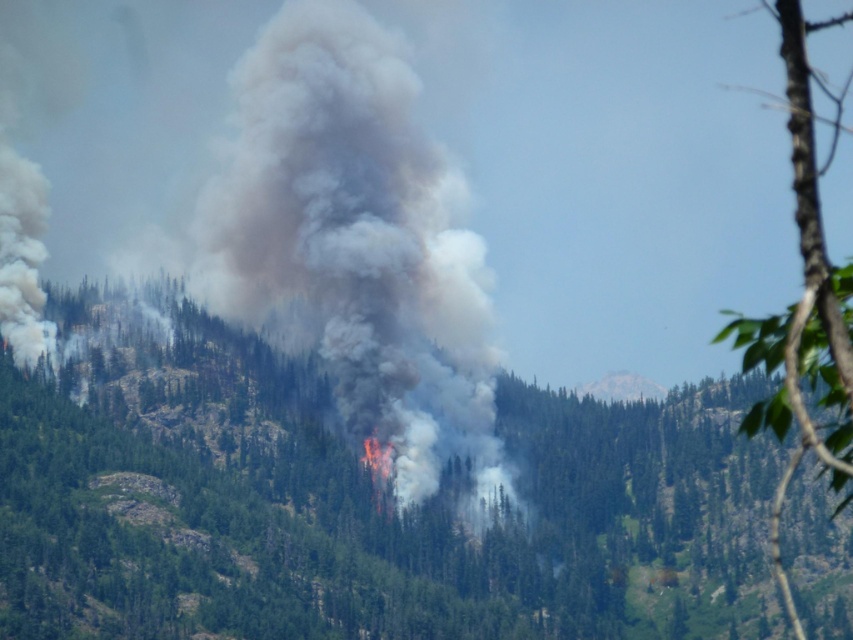
Looking at this image, is green leafy tree at center wider than gray/dense smoke at center?

Indeed, green leafy tree at center has a greater width compared to gray/dense smoke at center.

Does green leafy tree at center lie behind gray/dense smoke at center?

No, it is not.

Does point (665, 524) come farther from viewer compared to point (271, 109)?

No, (665, 524) is in front of (271, 109).

Locate an element on the screen. The image size is (853, 640). green leafy tree at center is located at coordinates (357, 500).